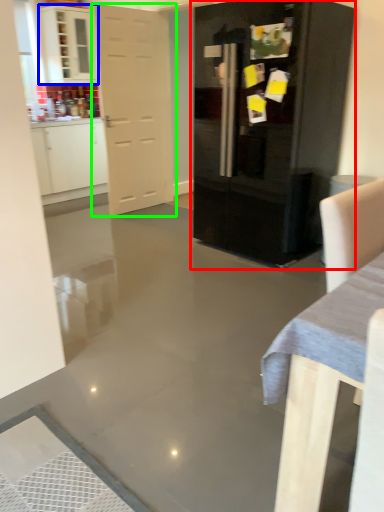
Question: Estimate the real-world distances between objects in this image. Which object is closer to cupboard (highlighted by a red box), cabinetry (highlighted by a blue box) or door (highlighted by a green box)?

Choices:
 (A) cabinetry
 (B) door

Answer: (B)